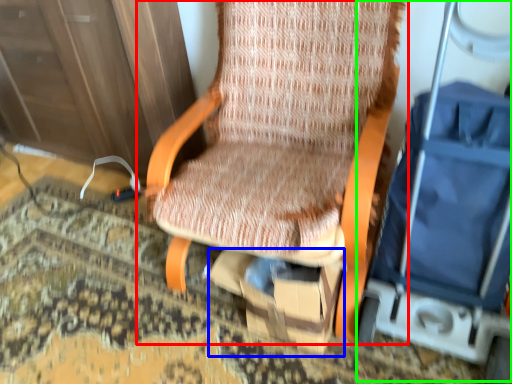
Question: Considering the real-world distances, which object is farthest from chair (highlighted by a red box)? cardboard box (highlighted by a blue box) or baby carriage (highlighted by a green box)?

Choices:
 (A) cardboard box
 (B) baby carriage

Answer: (B)